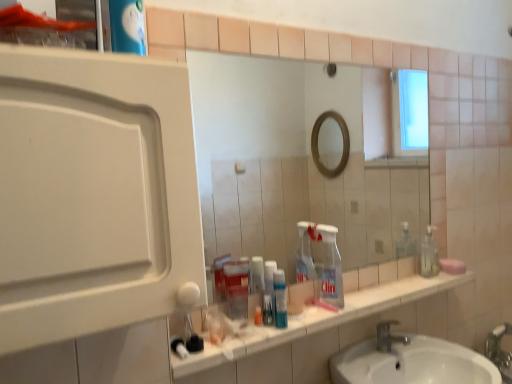
Question: Is silver metallic faucet at lower center located outside pink matte soap at right?

Choices:
 (A) no
 (B) yes

Answer: (B)

Question: Does silver metallic faucet at lower center appear on the right side of pink matte soap at right?

Choices:
 (A) yes
 (B) no

Answer: (B)

Question: From the image's perspective, is silver metallic faucet at lower center located beneath pink matte soap at right?

Choices:
 (A) no
 (B) yes

Answer: (B)

Question: Considering the relative positions of silver metallic faucet at lower center and pink matte soap at right in the image provided, is silver metallic faucet at lower center to the left of pink matte soap at right from the viewer's perspective?

Choices:
 (A) no
 (B) yes

Answer: (B)

Question: From a real-world perspective, is silver metallic faucet at lower center positioned over pink matte soap at right based on gravity?

Choices:
 (A) no
 (B) yes

Answer: (A)

Question: Is the surface of silver metallic faucet at lower center in direct contact with pink matte soap at right?

Choices:
 (A) yes
 (B) no

Answer: (B)

Question: Can you confirm if clear plastic bottle at center is positioned to the right of pink matte soap at right?

Choices:
 (A) yes
 (B) no

Answer: (B)

Question: From the image's perspective, does clear plastic bottle at center appear lower than pink matte soap at right?

Choices:
 (A) yes
 (B) no

Answer: (B)

Question: Is clear plastic bottle at center far from pink matte soap at right?

Choices:
 (A) no
 (B) yes

Answer: (A)

Question: Is clear plastic bottle at center placed right next to pink matte soap at right?

Choices:
 (A) yes
 (B) no

Answer: (B)

Question: Is clear plastic bottle at center further to the viewer compared to pink matte soap at right?

Choices:
 (A) yes
 (B) no

Answer: (B)

Question: From the image's perspective, is clear plastic bottle at center on top of pink matte soap at right?

Choices:
 (A) yes
 (B) no

Answer: (A)

Question: Is white matte medicine cabinet at left at the right side of translucent plastic container at center, which is the first bottle in left-to-right order?

Choices:
 (A) no
 (B) yes

Answer: (A)